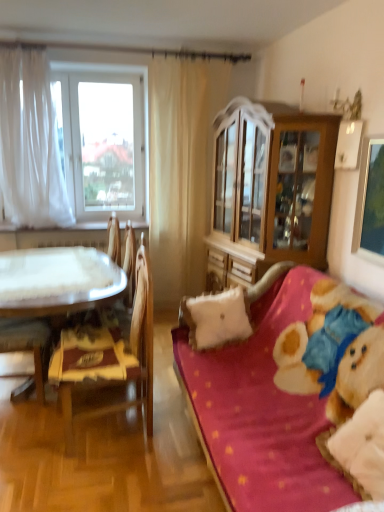
Where is `spots to the right of wooden chair at left`? The height and width of the screenshot is (512, 384). spots to the right of wooden chair at left is located at coordinates click(172, 442).